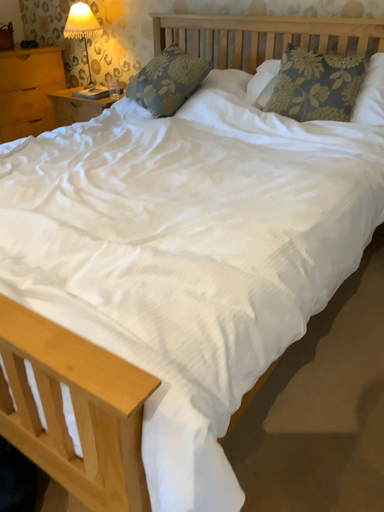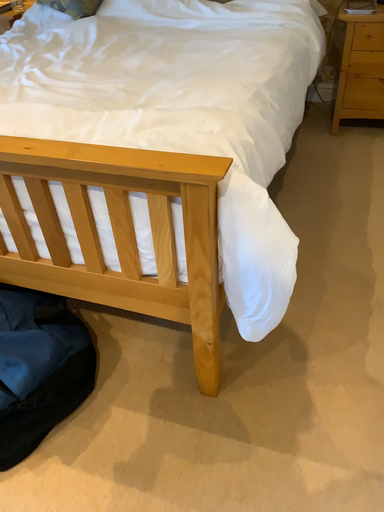
Question: Which way did the camera rotate in the video?

Choices:
 (A) rotated right
 (B) rotated left

Answer: (A)